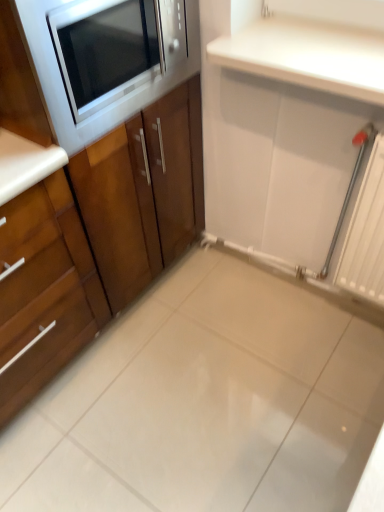
Question: Considering the relative positions of wooden cabinet at left, placed as the 2th cabinetry when sorted from right to left, and white glossy countertop at upper right in the image provided, is wooden cabinet at left, placed as the 2th cabinetry when sorted from right to left, to the right of white glossy countertop at upper right from the viewer's perspective?

Choices:
 (A) no
 (B) yes

Answer: (A)

Question: Is wooden cabinet at left, which appears as the first cabinetry when viewed from the left, facing away from white glossy countertop at upper right?

Choices:
 (A) yes
 (B) no

Answer: (B)

Question: Does wooden cabinet at left, placed as the 2th cabinetry when sorted from right to left, have a larger size compared to white glossy countertop at upper right?

Choices:
 (A) yes
 (B) no

Answer: (A)

Question: Is wooden cabinet at left, placed as the 2th cabinetry when sorted from right to left, located outside white glossy countertop at upper right?

Choices:
 (A) yes
 (B) no

Answer: (A)

Question: Is wooden cabinet at left, which appears as the first cabinetry when viewed from the left, oriented towards white glossy countertop at upper right?

Choices:
 (A) no
 (B) yes

Answer: (A)

Question: Is the position of wooden cabinet at left, which appears as the first cabinetry when viewed from the left, more distant than that of white glossy countertop at upper right?

Choices:
 (A) yes
 (B) no

Answer: (B)

Question: Considering the relative sizes of white glossy countertop at upper right and wooden cabinet at left, arranged as the first cabinetry when viewed from the right, in the image provided, is white glossy countertop at upper right shorter than wooden cabinet at left, arranged as the first cabinetry when viewed from the right,?

Choices:
 (A) no
 (B) yes

Answer: (B)

Question: Is white glossy countertop at upper right not inside wooden cabinet at left, the second cabinetry in the left-to-right sequence?

Choices:
 (A) no
 (B) yes

Answer: (B)

Question: Could you tell me if white glossy countertop at upper right is facing wooden cabinet at left, arranged as the first cabinetry when viewed from the right?

Choices:
 (A) no
 (B) yes

Answer: (A)

Question: From a real-world perspective, is white glossy countertop at upper right on top of wooden cabinet at left, the second cabinetry in the left-to-right sequence?

Choices:
 (A) no
 (B) yes

Answer: (B)

Question: Is wooden cabinet at left, arranged as the first cabinetry when viewed from the right, located within white glossy countertop at upper right?

Choices:
 (A) no
 (B) yes

Answer: (A)

Question: Does white glossy countertop at upper right appear on the right side of wooden cabinet at left, the second cabinetry in the left-to-right sequence?

Choices:
 (A) no
 (B) yes

Answer: (B)

Question: From a real-world perspective, is wooden cabinet at left, which appears as the first cabinetry when viewed from the left, positioned under white glossy ceramic tile at center based on gravity?

Choices:
 (A) no
 (B) yes

Answer: (A)